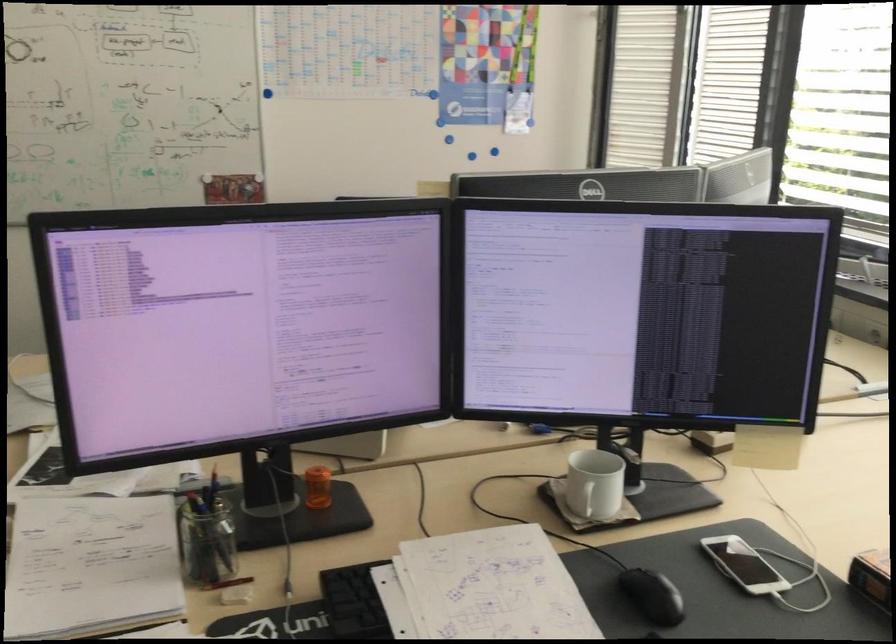
You are a GUI agent. You are given a task and a screenshot of the screen. Output one action in this format:
    pyautogui.click(x=<x>, y=<y>)
    Task: Click on the white mug handle
    
    Given the screenshot: What is the action you would take?
    pyautogui.click(x=583, y=498)